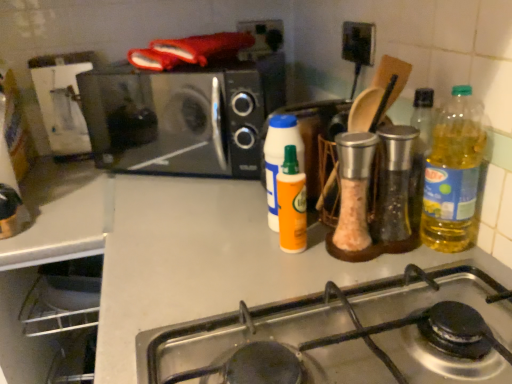
You are a GUI agent. You are given a task and a screenshot of the screen. Output one action in this format:
    pyautogui.click(x=<x>, y=<y>)
    Task: Click on the free space in front of orange matte bottle at center, which appears as the 4th bottle when viewed from the right
    This screenshot has height=384, width=512.
    Given the screenshot: What is the action you would take?
    pyautogui.click(x=271, y=271)